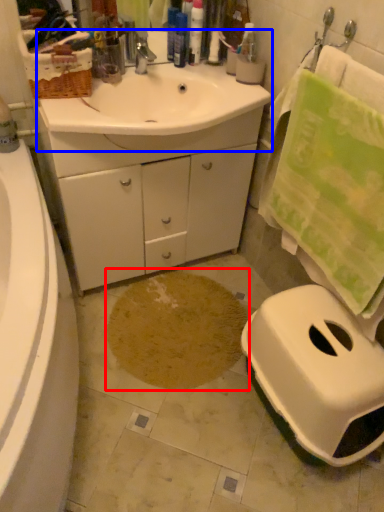
Question: Which object is closer to the camera taking this photo, footprint (highlighted by a red box) or sink (highlighted by a blue box)?

Choices:
 (A) footprint
 (B) sink

Answer: (B)